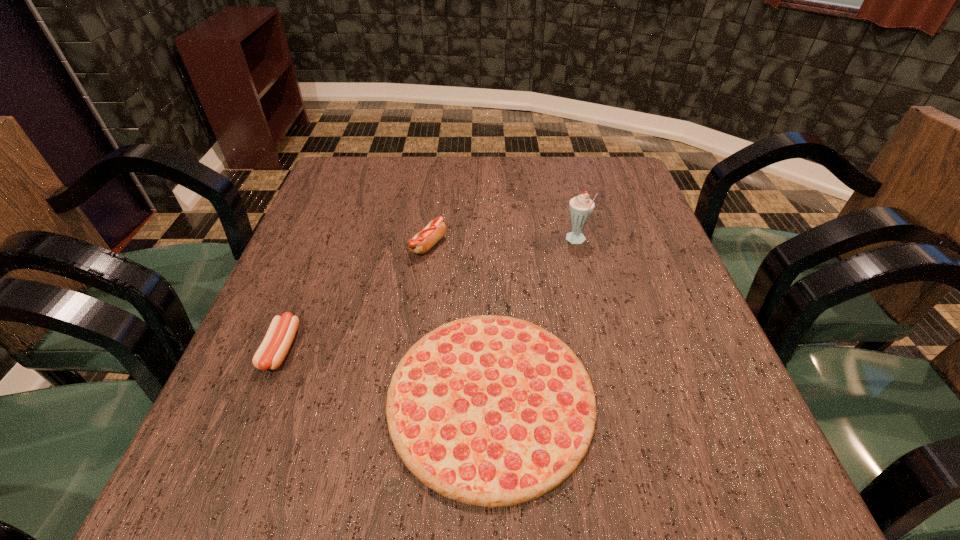
You are a GUI agent. You are given a task and a screenshot of the screen. Output one action in this format:
    pyautogui.click(x=<x>, y=<y>)
    Task: Click on the free space between the tallest object and the shortest object
    
    Given the screenshot: What is the action you would take?
    pyautogui.click(x=534, y=320)

Identify the location of vacant area that lies between the taller sausage and the milkshake. (502, 243).

Image resolution: width=960 pixels, height=540 pixels. Find the location of `vacant space in between the tallest object and the second shortest object`. vacant space in between the tallest object and the second shortest object is located at coordinates (428, 295).

Identify the location of blank region between the second tallest object and the milkshake. The height and width of the screenshot is (540, 960). (502, 243).

Where is `free space between the second tallest object and the tallest object`? This screenshot has height=540, width=960. free space between the second tallest object and the tallest object is located at coordinates (502, 243).

Locate an element on the screen. The image size is (960, 540). free spot between the shorter sausage and the rightmost object is located at coordinates (428, 295).

Locate an element on the screen. This screenshot has height=540, width=960. empty space between the pizza and the left sausage is located at coordinates (386, 373).

I want to click on object that is the third nearest to the milkshake, so click(x=279, y=337).

Where is `object that is the closest to the pizza`? object that is the closest to the pizza is located at coordinates (423, 241).

At what (x,y) coordinates should I click in order to perform the action: click on vacant space that satisfies the following two spatial constraints: 1. on the straw side of the milkshake; 2. on the front side of the farther sausage. Please return your answer as a coordinate pair (x, y). The image size is (960, 540). Looking at the image, I should click on (577, 246).